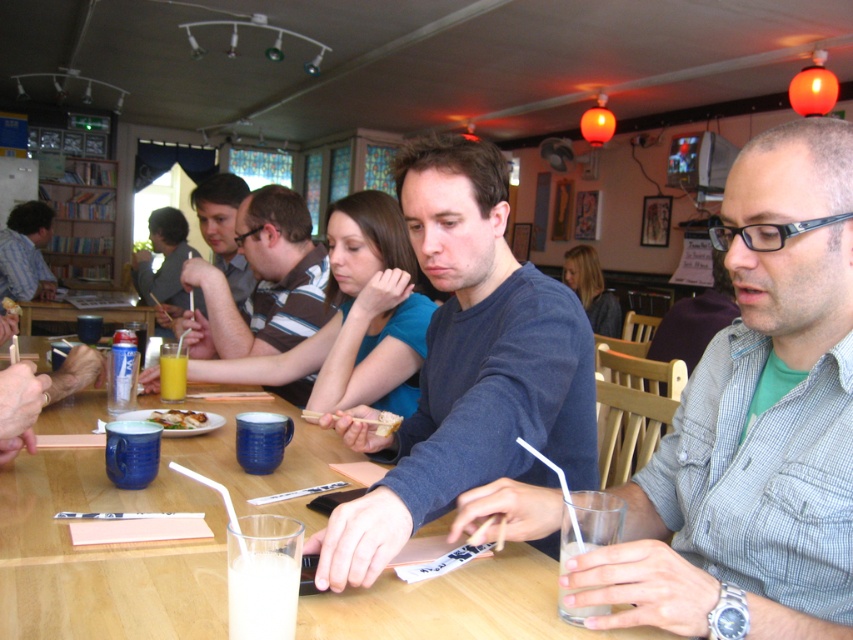
You are a waiter in the dining establishment. You need to place a new order of white bread at center on the table. However, there is already a matte blue shirt at center on the table. Can you put the new bread there without moving the shirt?

The matte blue shirt at center is above the white bread at center, so the shirt is currently covering or blocking the area where the bread is placed. You would need to move the shirt to make space for the new bread.

You are a server in the dining establishment and need to deliver a new drink to the milky white liquid at lower left. Where should you place the new drink relative to the point marked by coordinates point (x=262, y=595)?

The point (x=262, y=595) marks the milky white liquid at lower left, so you should place the new drink near that location.